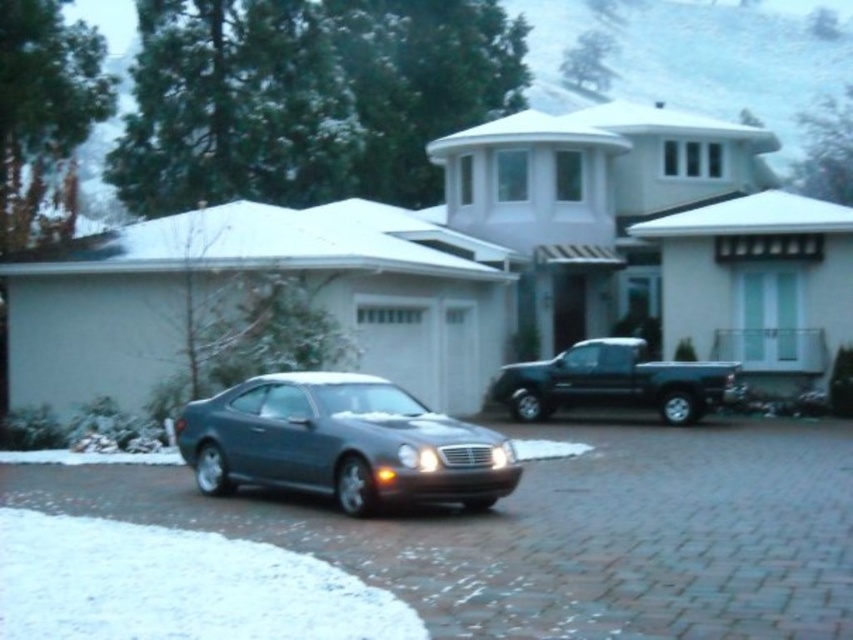
Question: Which point is closer to the camera?

Choices:
 (A) satin silver car at center
 (B) matte black truck at center
 (C) satin silver coupe at center

Answer: (A)

Question: Can you confirm if satin silver car at center is smaller than satin silver coupe at center?

Choices:
 (A) yes
 (B) no

Answer: (B)

Question: Which point is closer to the camera taking this photo?

Choices:
 (A) (387, 401)
 (B) (511, 371)

Answer: (A)

Question: Can you confirm if satin silver coupe at center is bigger than matte black truck at center?

Choices:
 (A) yes
 (B) no

Answer: (B)

Question: Considering the relative positions of satin silver coupe at center and matte black truck at center in the image provided, where is satin silver coupe at center located with respect to matte black truck at center?

Choices:
 (A) below
 (B) above

Answer: (A)

Question: Which of the following is the farthest from the observer?

Choices:
 (A) satin silver car at center
 (B) satin silver coupe at center
 (C) matte black truck at center

Answer: (C)